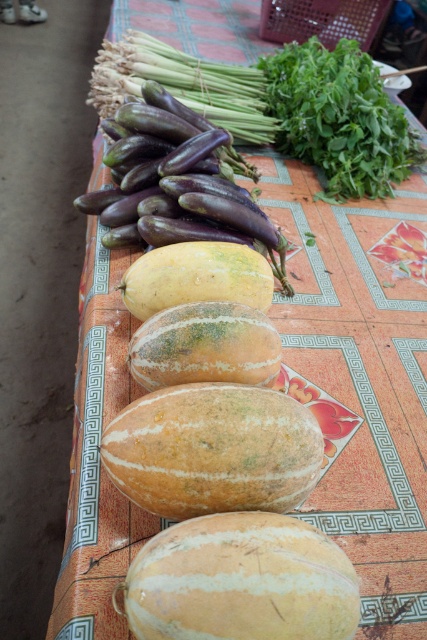
Who is positioned more to the right, green striped melon at center or yellow-green matte squash at center?

From the viewer's perspective, green striped melon at center appears more on the right side.

Can you confirm if green striped melon at center is wider than yellow-green matte squash at center?

In fact, green striped melon at center might be narrower than yellow-green matte squash at center.

This screenshot has height=640, width=427. What do you see at coordinates (204, 346) in the screenshot?
I see `green striped melon at center` at bounding box center [204, 346].

What are the coordinates of `green striped melon at center` in the screenshot? It's located at (204, 346).

Consider the image. Is greenish-yellow textured cantaloupe at center above yellow-green matte squash at center?

Actually, greenish-yellow textured cantaloupe at center is below yellow-green matte squash at center.

Can you confirm if greenish-yellow textured cantaloupe at center is thinner than yellow-green matte squash at center?

Correct, greenish-yellow textured cantaloupe at center's width is less than yellow-green matte squash at center's.

What do you see at coordinates (240, 580) in the screenshot? Image resolution: width=427 pixels, height=640 pixels. I see `greenish-yellow textured cantaloupe at center` at bounding box center [240, 580].

At what (x,y) coordinates should I click in order to perform the action: click on greenish-yellow textured cantaloupe at center. Please return your answer as a coordinate pair (x, y). Looking at the image, I should click on (240, 580).

Is greenish-yellow textured cantaloupe at center smaller than speckled brown squash at center?

Indeed, greenish-yellow textured cantaloupe at center has a smaller size compared to speckled brown squash at center.

Who is lower down, greenish-yellow textured cantaloupe at center or speckled brown squash at center?

greenish-yellow textured cantaloupe at center

What do you see at coordinates (240, 580) in the screenshot?
I see `greenish-yellow textured cantaloupe at center` at bounding box center [240, 580].

Find the location of a particular element. This screenshot has width=427, height=640. greenish-yellow textured cantaloupe at center is located at coordinates (240, 580).